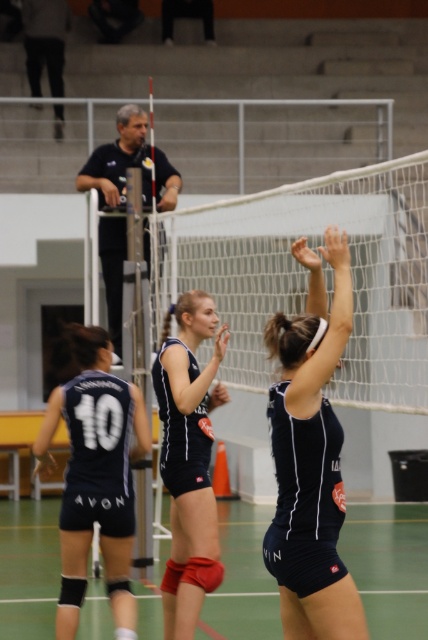
Is matte black volleyball net at center wider than dark blue shirt at upper left?

No.

Does point (297, 596) come closer to viewer compared to point (166, 161)?

Yes, it is.

Between point (315, 548) and point (109, 161), which one is positioned behind?

The point (109, 161) is behind.

This screenshot has width=428, height=640. In order to click on matte black volleyball net at center in this screenshot , I will do `click(311, 458)`.

Can you confirm if matte black volleyball net at center is positioned above matte blue uniform at center?

Correct, matte black volleyball net at center is located above matte blue uniform at center.

Can you confirm if matte black volleyball net at center is smaller than matte blue uniform at center?

Yes, matte black volleyball net at center is smaller than matte blue uniform at center.

Which is behind, point (284, 442) or point (160, 381)?

Positioned behind is point (160, 381).

The image size is (428, 640). Find the location of `matte black volleyball net at center`. matte black volleyball net at center is located at coordinates (311, 458).

Can you confirm if matte black volleyball net at center is wider than matte blue jersey at center?

Incorrect, matte black volleyball net at center's width does not surpass matte blue jersey at center's.

Does matte black volleyball net at center appear over matte blue jersey at center?

Yes, matte black volleyball net at center is above matte blue jersey at center.

Measure the distance between point (339, 252) and camera.

They are 5.90 meters apart.

Where is `matte black volleyball net at center`? This screenshot has height=640, width=428. matte black volleyball net at center is located at coordinates (311, 458).